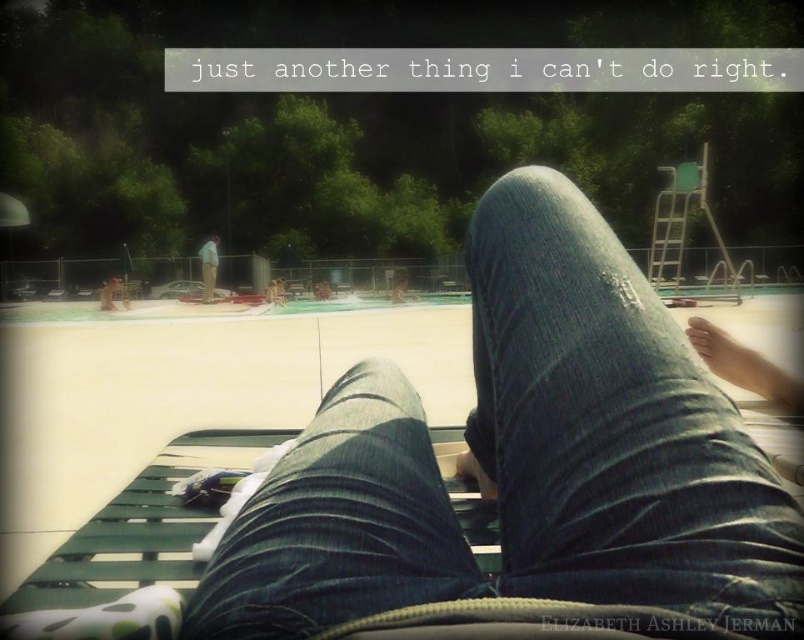
The width and height of the screenshot is (804, 640). What do you see at coordinates (523, 460) in the screenshot?
I see `denim jeans at center` at bounding box center [523, 460].

What do you see at coordinates (523, 460) in the screenshot?
I see `denim jeans at center` at bounding box center [523, 460].

Locate an element on the screen. The width and height of the screenshot is (804, 640). denim jeans at center is located at coordinates (523, 460).

Does smooth skin foot at lower right appear over light green fabric at center?

No, smooth skin foot at lower right is not above light green fabric at center.

Does point (753, 380) come in front of point (201, 266)?

Yes, it is.

The image size is (804, 640). I want to click on smooth skin foot at lower right, so click(x=745, y=365).

Who is taller, light green fabric at center or smooth tan skin at center?

With more height is light green fabric at center.

The image size is (804, 640). Describe the element at coordinates (208, 266) in the screenshot. I see `light green fabric at center` at that location.

Which is behind, point (207, 292) or point (402, 300)?

The point (207, 292) is more distant.

Identify the location of light green fabric at center. (208, 266).